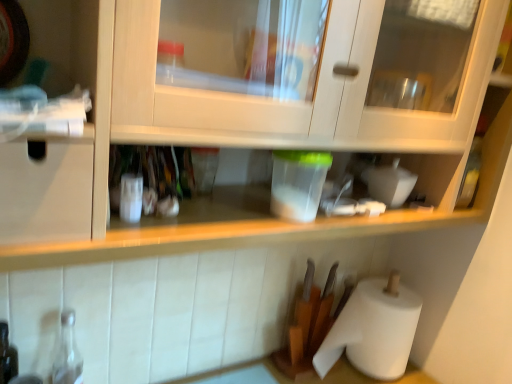
Question: Can you confirm if transparent glass bottle at lower left is bigger than white paper at lower right?

Choices:
 (A) yes
 (B) no

Answer: (B)

Question: Does transparent glass bottle at lower left have a greater height compared to white paper at lower right?

Choices:
 (A) yes
 (B) no

Answer: (B)

Question: Are transparent glass bottle at lower left and white paper at lower right located far from each other?

Choices:
 (A) yes
 (B) no

Answer: (B)

Question: From a real-world perspective, is transparent glass bottle at lower left physically below white paper at lower right?

Choices:
 (A) yes
 (B) no

Answer: (A)

Question: Is transparent glass bottle at lower left smaller than white paper at lower right?

Choices:
 (A) yes
 (B) no

Answer: (A)

Question: Is transparent glass bottle at lower left turned away from white paper at lower right?

Choices:
 (A) yes
 (B) no

Answer: (B)

Question: Is white paper at lower right looking in the opposite direction of transparent glass bottle at lower left?

Choices:
 (A) yes
 (B) no

Answer: (B)

Question: Does white paper at lower right appear on the right side of transparent glass bottle at lower left?

Choices:
 (A) no
 (B) yes

Answer: (B)

Question: From the image's perspective, would you say white paper at lower right is positioned over transparent glass bottle at lower left?

Choices:
 (A) no
 (B) yes

Answer: (B)

Question: Can you confirm if white paper at lower right is thinner than transparent glass bottle at lower left?

Choices:
 (A) no
 (B) yes

Answer: (A)

Question: Considering the relative sizes of white paper at lower right and transparent glass bottle at lower left in the image provided, is white paper at lower right shorter than transparent glass bottle at lower left?

Choices:
 (A) no
 (B) yes

Answer: (A)

Question: Can you confirm if white paper at lower right is bigger than transparent glass bottle at lower left?

Choices:
 (A) yes
 (B) no

Answer: (A)

Question: From the image's perspective, relative to transparent glass bottle at lower left, is white paper at lower right above or below?

Choices:
 (A) above
 (B) below

Answer: (A)